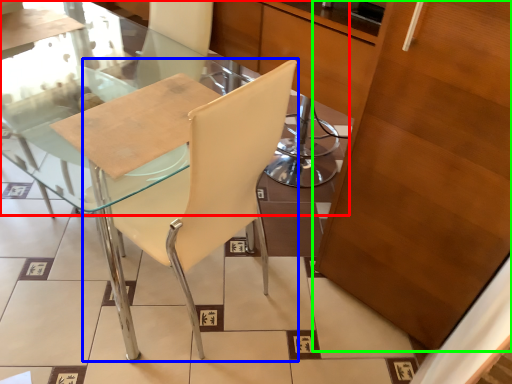
Question: Estimate the real-world distances between objects in this image. Which object is closer to glass table (highlighted by a red box), chair (highlighted by a blue box) or cabinetry (highlighted by a green box)?

Choices:
 (A) chair
 (B) cabinetry

Answer: (A)